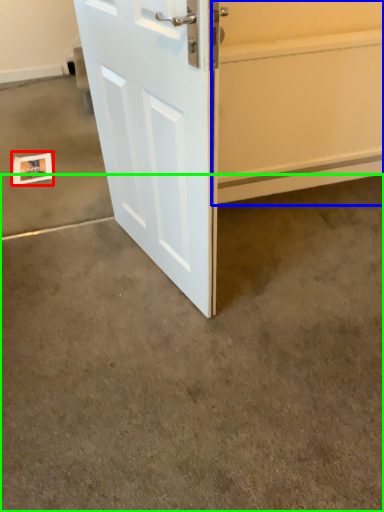
Question: Based on their relative distances, which object is farther from postcard (highlighted by a red box)? Choose from garage door (highlighted by a blue box) and concrete (highlighted by a green box).

Choices:
 (A) garage door
 (B) concrete

Answer: (A)